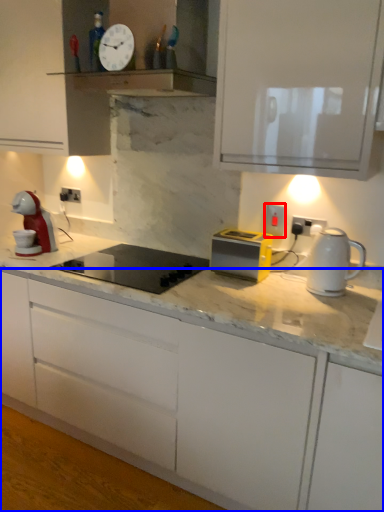
Question: Which object appears farthest to the camera in this image, electric outlet (highlighted by a red box) or cabinetry (highlighted by a blue box)?

Choices:
 (A) electric outlet
 (B) cabinetry

Answer: (A)